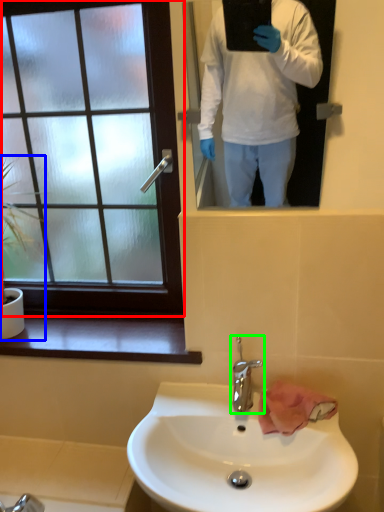
Question: Based on their relative distances, which object is nearer to window (highlighted by a red box)? Choose from houseplant (highlighted by a blue box) and tap (highlighted by a green box).

Choices:
 (A) houseplant
 (B) tap

Answer: (A)